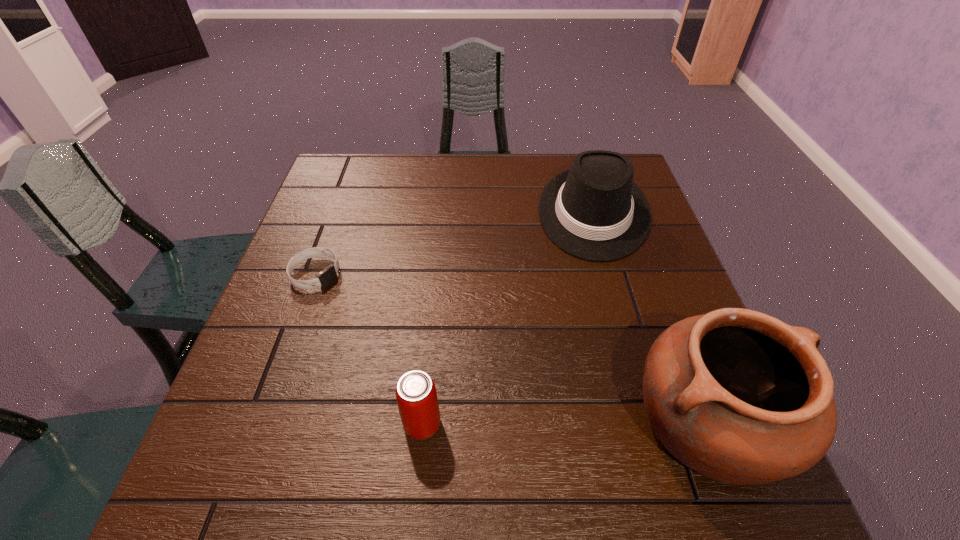
This screenshot has height=540, width=960. I want to click on free space between the beer can and the pottery, so [x=565, y=423].

This screenshot has width=960, height=540. Identify the location of unoccupied area between the third object from right to left and the leftmost object. (369, 349).

Find the location of `free space between the shortest object and the fedora`. free space between the shortest object and the fedora is located at coordinates (x=454, y=243).

Locate an element on the screen. vacant space in between the beer can and the leftmost object is located at coordinates (369, 349).

The image size is (960, 540). I want to click on free space between the fedora and the tallest object, so click(x=651, y=318).

Locate which object is the closest to the beer can. Please provide its 2D coordinates. Your answer should be formatted as a tuple, i.e. [(x, y)], where the tuple contains the x and y coordinates of a point satisfying the conditions above.

[(738, 396)]

Identify which object is located as the nearest to the shortest object. Please provide its 2D coordinates. Your answer should be formatted as a tuple, i.e. [(x, y)], where the tuple contains the x and y coordinates of a point satisfying the conditions above.

[(416, 395)]

I want to click on vacant space that satisfies the following two spatial constraints: 1. on the back side of the second object from left to right; 2. on the left side of the tallest object, so click(422, 423).

Locate an element on the screen. The width and height of the screenshot is (960, 540). free space that satisfies the following two spatial constraints: 1. on the front side of the fedora; 2. on the right side of the tallest object is located at coordinates (655, 423).

Where is `vacant space that satisfies the following two spatial constraints: 1. on the front side of the leftmost object; 2. on the right side of the pottery`? Image resolution: width=960 pixels, height=540 pixels. vacant space that satisfies the following two spatial constraints: 1. on the front side of the leftmost object; 2. on the right side of the pottery is located at coordinates (261, 423).